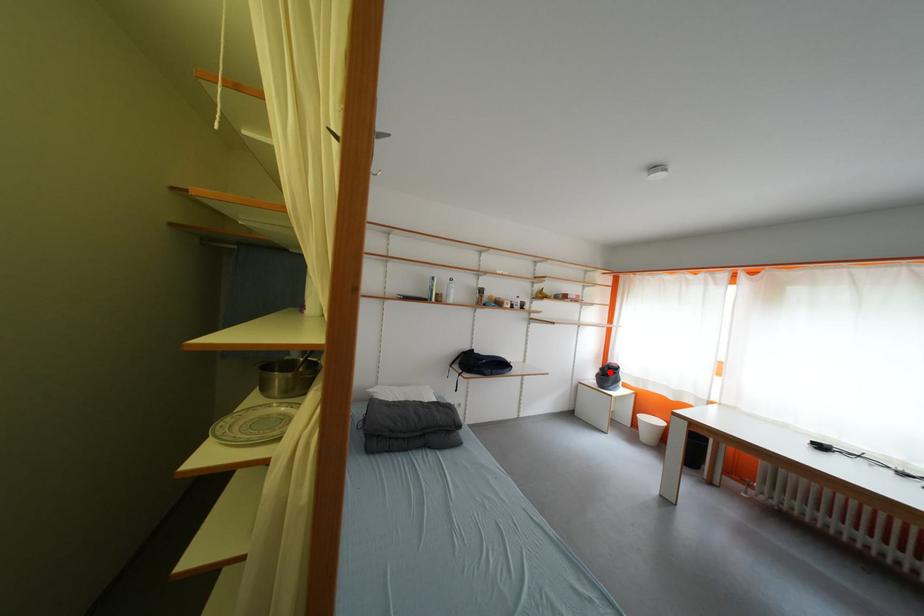
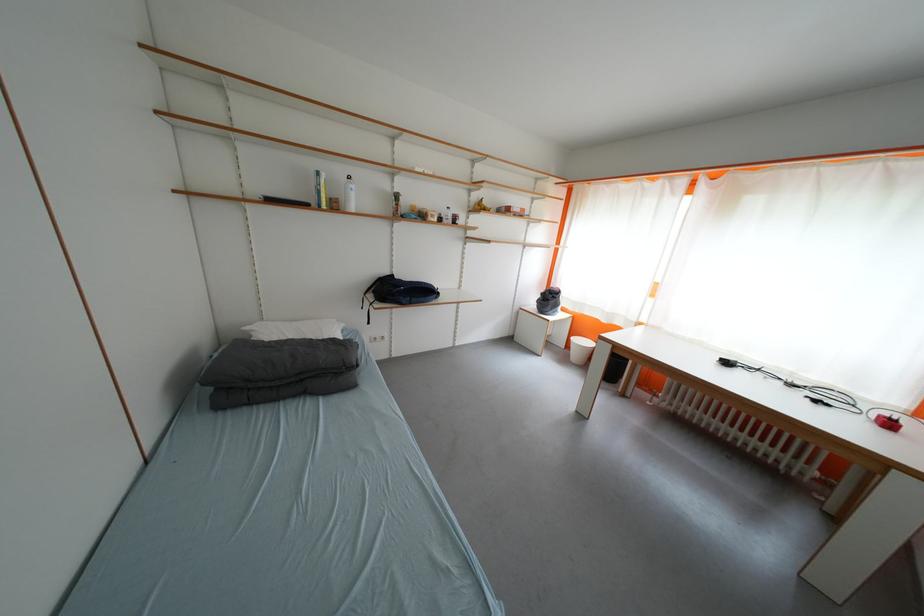
Question: I am providing you with two images of the same scene from different viewpoints. Given a red point in image1, look at the same physical point in image2. Is it:

Choices:
 (A) Closer to the viewpoint
 (B) Farther from the viewpoint

Answer: (A)